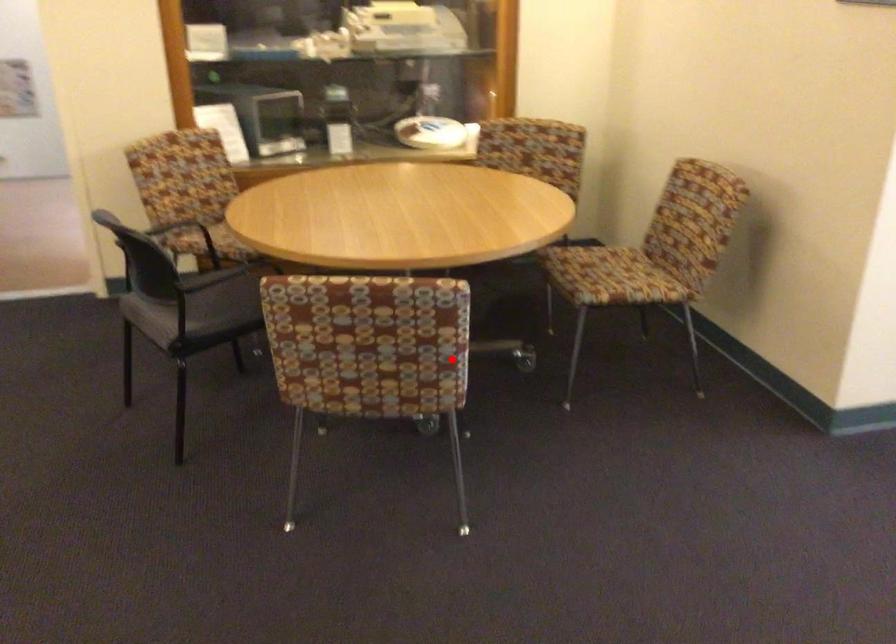
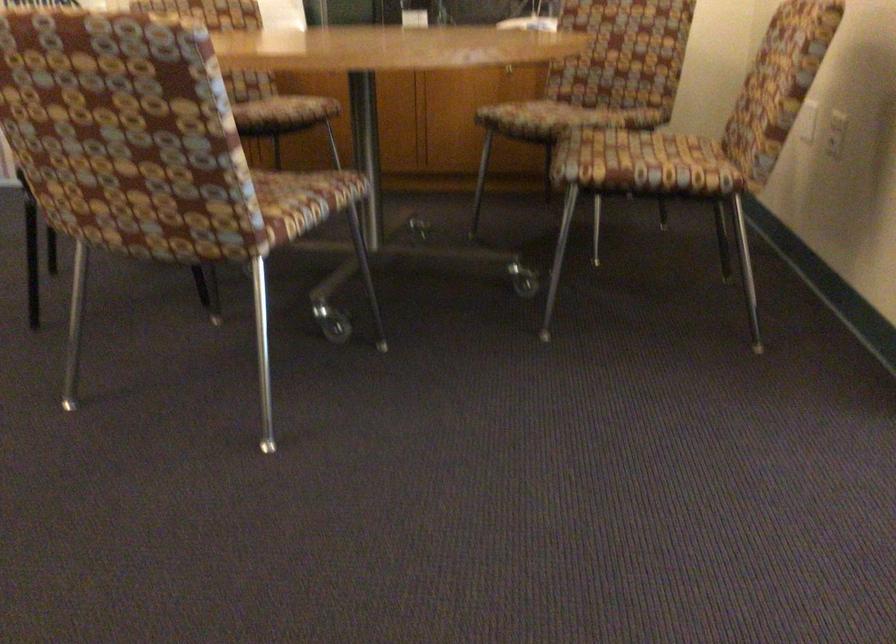
The point at the highlighted location is marked in the first image. Where is the corresponding point in the second image?

(289, 204)